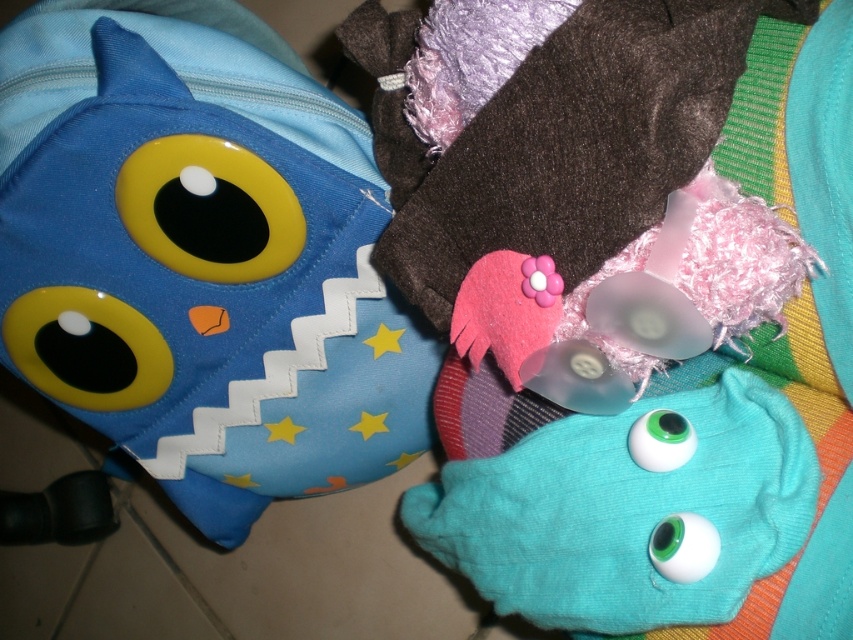
You are a child trying to reach both the teal fabric blanket at upper right and the teal fabric eyes at center from your current position. Which item is closer to your hand?

The teal fabric eyes at center is closer because it is only 1.27 inches away from the teal fabric blanket at upper right, but since you are reaching from your current position, the distance between them doesn

You are organizing a toy shelf and need to place the matte blue plush toy at left and the teal fabric blanket at upper right. Given their sizes, which one should be placed on the lower shelf to ensure stability?

The matte blue plush toy at left is much taller than the teal fabric blanket at upper right, so it should be placed on the lower shelf to ensure stability.

You are looking at the arrangement of items in the scene. There are two points marked in the image. The first point is at coordinate point (149, 228) and the second is at point (525, 499). Which of these two points is closer to you?

Point (149, 228) is further to the camera than point (525, 499), so the second point is closer to you.